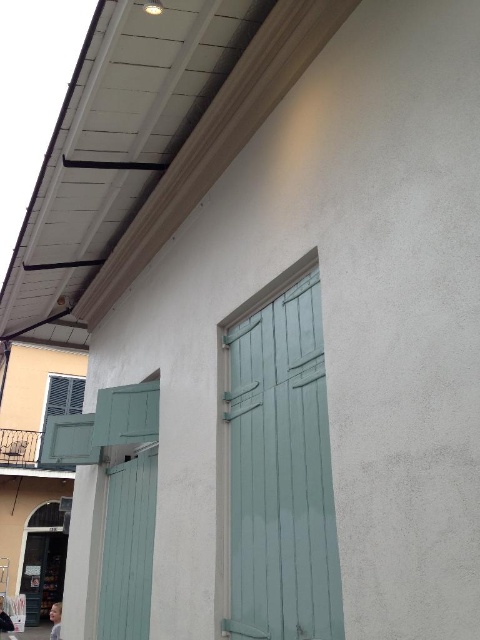
Question: Among these objects, which one is nearest to the camera?

Choices:
 (A) teal wood shutter at center
 (B) teal wood shutter at lower left

Answer: (A)

Question: Among these points, which one is farthest from the camera?

Choices:
 (A) (254, 593)
 (B) (134, 618)

Answer: (B)

Question: Which of the following is the farthest from the observer?

Choices:
 (A) (237, 532)
 (B) (141, 461)

Answer: (B)

Question: Can you confirm if teal wood shutter at center is positioned to the right of teal wood shutter at lower left?

Choices:
 (A) no
 (B) yes

Answer: (B)

Question: Is teal wood shutter at center to the left of teal wood shutter at lower left from the viewer's perspective?

Choices:
 (A) no
 (B) yes

Answer: (A)

Question: Does teal wood shutter at center come behind teal wood shutter at lower left?

Choices:
 (A) yes
 (B) no

Answer: (B)